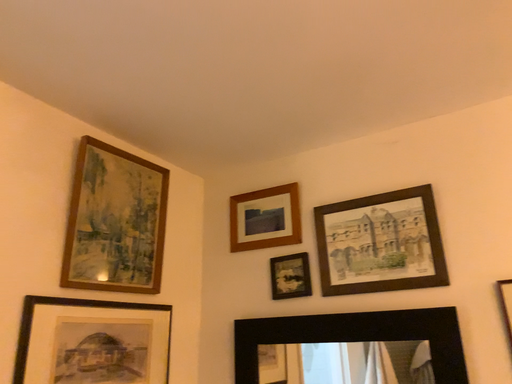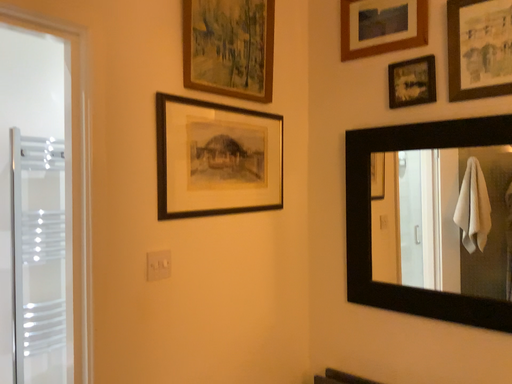
Question: How did the camera likely rotate when shooting the video?

Choices:
 (A) rotated right
 (B) rotated left

Answer: (B)